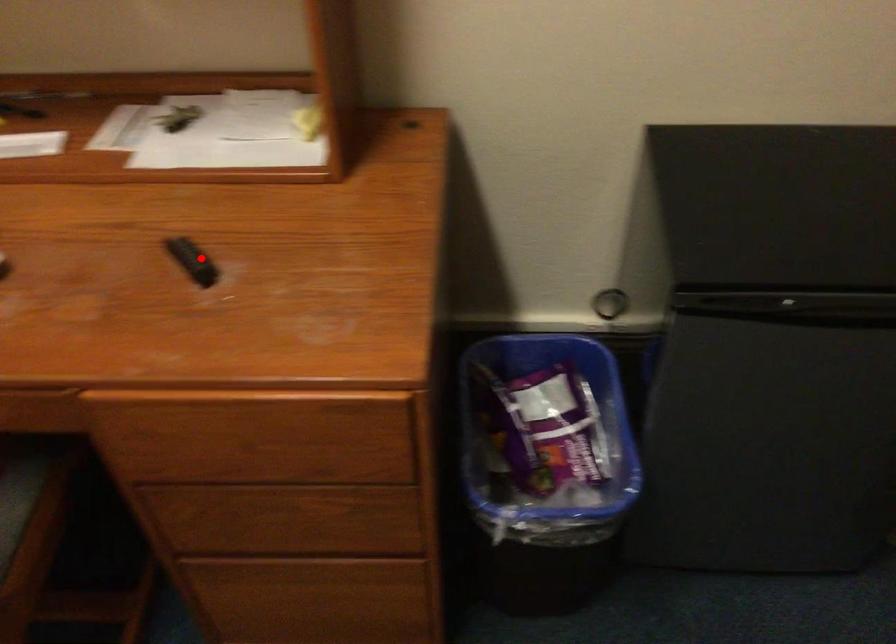
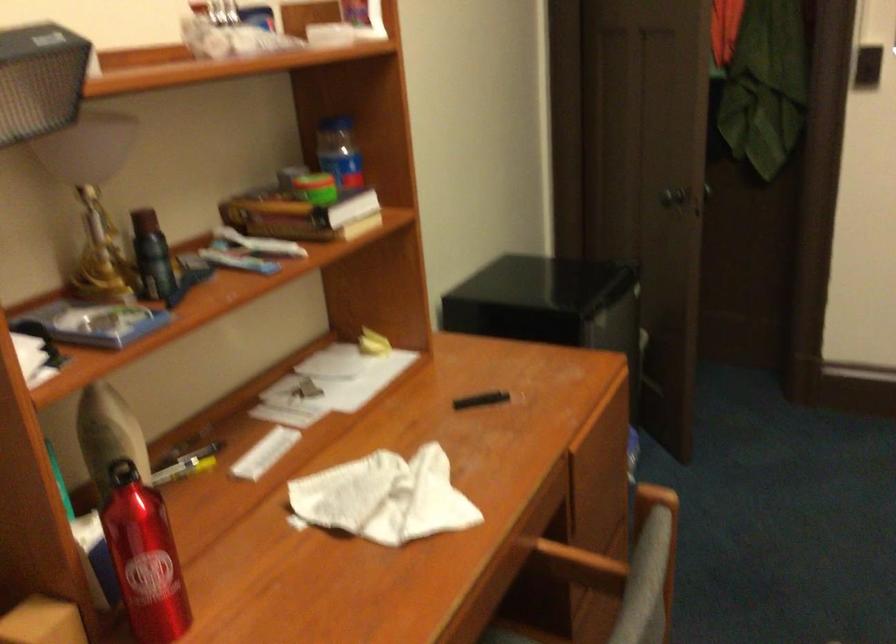
Find the pixel in the second image that matches the highlighted location in the first image.

(480, 400)